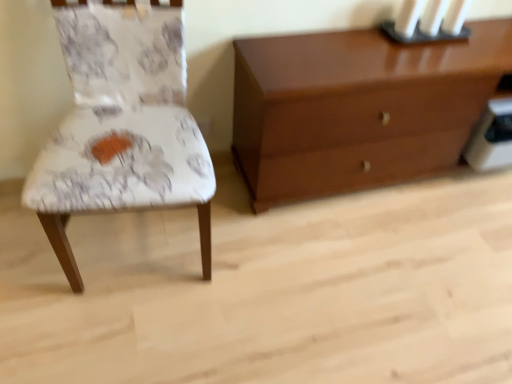
This screenshot has height=384, width=512. I want to click on vacant area to the right of white fabric chair at left, so click(268, 266).